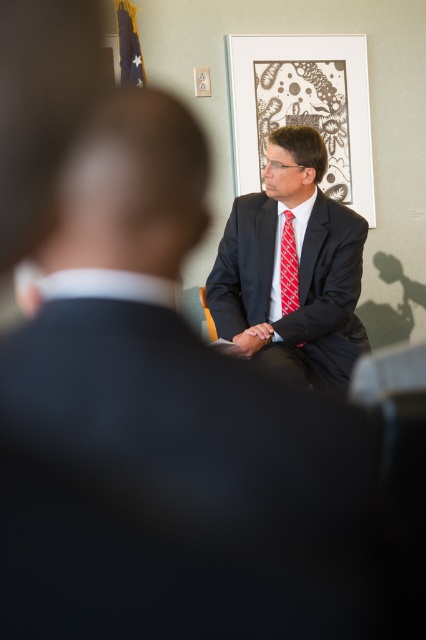
Is point (244, 157) positioned behind point (284, 314)?

Yes, point (244, 157) is behind point (284, 314).

Is matte paper picture frame at upper center further to the viewer compared to red checkered tie at center?

Yes, it is behind red checkered tie at center.

Find the location of `matte paper picture frame at upper center`. matte paper picture frame at upper center is located at coordinates (302, 108).

Is matte black suit at center to the left of matte paper picture frame at upper center from the viewer's perspective?

Correct, you'll find matte black suit at center to the left of matte paper picture frame at upper center.

Where is `matte black suit at center`? The image size is (426, 640). matte black suit at center is located at coordinates (291, 269).

This screenshot has width=426, height=640. I want to click on matte black suit at center, so click(291, 269).

Is matte black suit at center taller than red checkered tie at center?

Yes, matte black suit at center is taller than red checkered tie at center.

From the picture: Does matte black suit at center have a larger size compared to red checkered tie at center?

Indeed, matte black suit at center has a larger size compared to red checkered tie at center.

Is point (262, 316) positioned in front of point (294, 278)?

No, (262, 316) is behind (294, 278).

Where is `matte black suit at center`? The width and height of the screenshot is (426, 640). matte black suit at center is located at coordinates [291, 269].